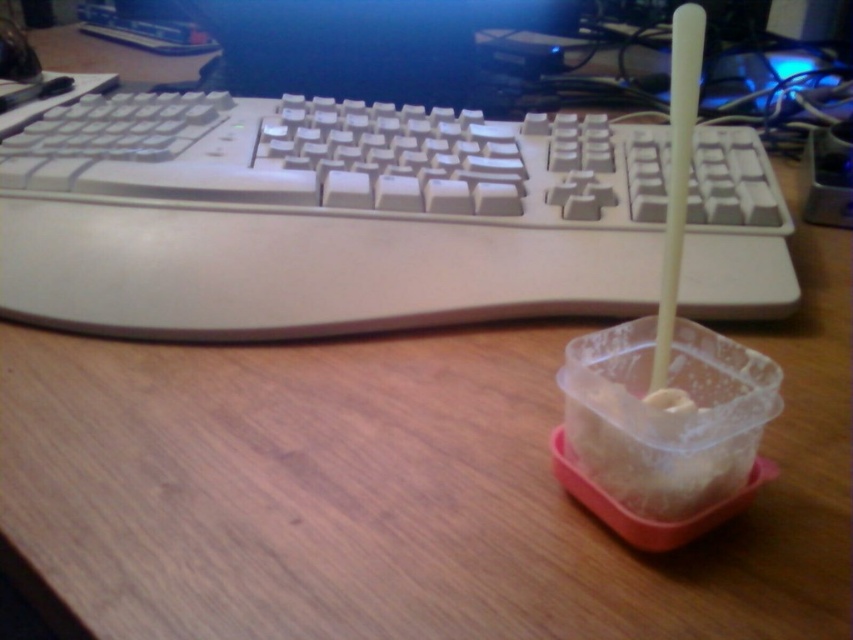
Question: Which point is farther to the camera?

Choices:
 (A) (672, 64)
 (B) (403, 49)
 (C) (498, 278)

Answer: (B)

Question: Does black plastic monitor at upper center come behind white plastic straw at right?

Choices:
 (A) no
 (B) yes

Answer: (B)

Question: Among these points, which one is nearest to the camera?

Choices:
 (A) (671, 314)
 (B) (262, 29)

Answer: (A)

Question: Which of these objects is positioned closest to the black plastic monitor at upper center?

Choices:
 (A) white plastic straw at right
 (B) white plastic keyboard at upper center

Answer: (B)

Question: Is white plastic keyboard at upper center below black plastic monitor at upper center?

Choices:
 (A) yes
 (B) no

Answer: (A)

Question: Can you confirm if white plastic keyboard at upper center is positioned below black plastic monitor at upper center?

Choices:
 (A) no
 (B) yes

Answer: (B)